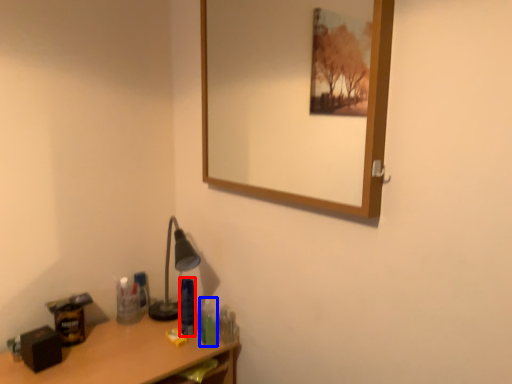
Question: Among these objects, which one is farthest to the camera, toiletry (highlighted by a red box) or toiletry (highlighted by a blue box)?

Choices:
 (A) toiletry
 (B) toiletry

Answer: (A)